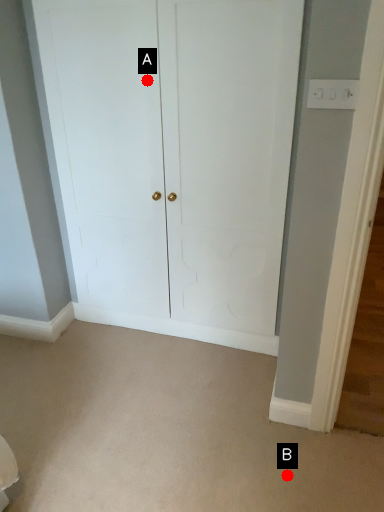
Question: Two points are circled on the image, labeled by A and B beside each circle. Which point is further to the camera?

Choices:
 (A) A is further
 (B) B is further

Answer: (A)